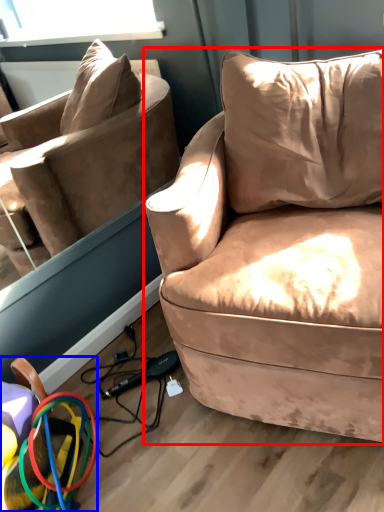
Question: Which object is further to the camera taking this photo, studio couch (highlighted by a red box) or toy (highlighted by a blue box)?

Choices:
 (A) studio couch
 (B) toy

Answer: (B)